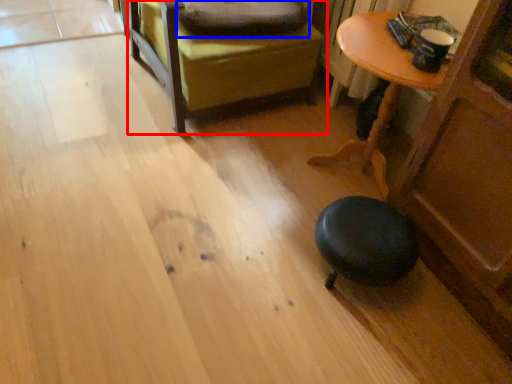
Question: Among these objects, which one is nearest to the camera, furniture (highlighted by a red box) or pillow (highlighted by a blue box)?

Choices:
 (A) furniture
 (B) pillow

Answer: (A)